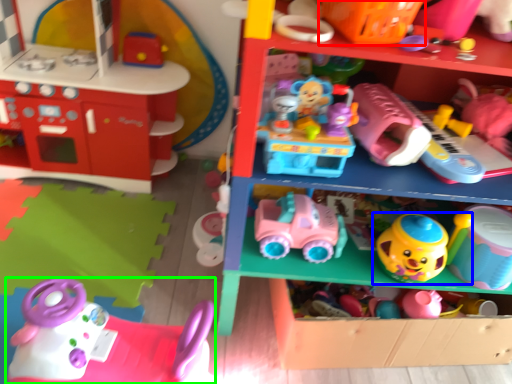
Question: Considering the real-world distances, which object is closest to toy (highlighted by a red box)? toy (highlighted by a blue box) or toy (highlighted by a green box).

Choices:
 (A) toy
 (B) toy

Answer: (A)